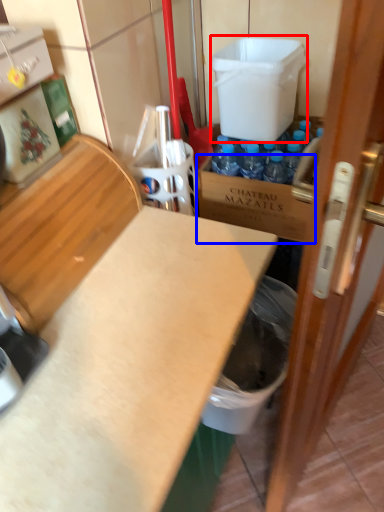
Question: Which object appears farthest to the camera in this image, water cooler (highlighted by a red box) or cardboard box (highlighted by a blue box)?

Choices:
 (A) water cooler
 (B) cardboard box

Answer: (B)